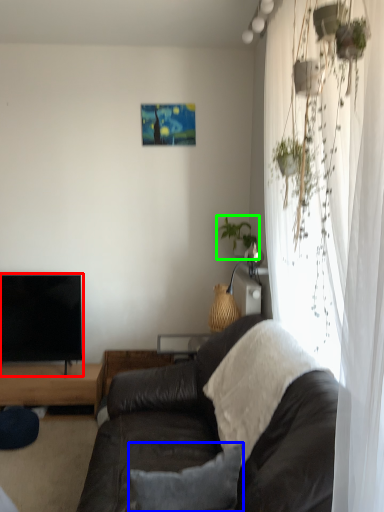
Question: Which object is positioned closest to television (highlighted by a red box)? Select from pillow (highlighted by a blue box) and houseplant (highlighted by a green box).

Choices:
 (A) pillow
 (B) houseplant

Answer: (B)